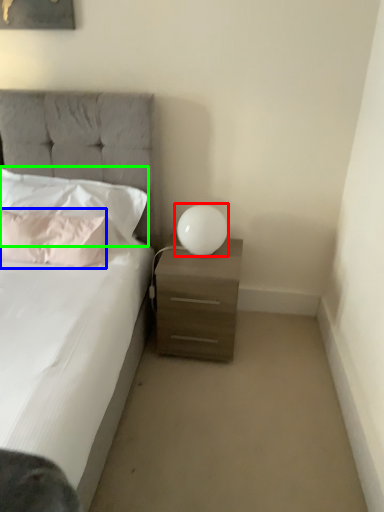
Question: Considering the real-world distances, which object is farthest from table lamp (highlighted by a red box)? pillow (highlighted by a blue box) or pillow (highlighted by a green box)?

Choices:
 (A) pillow
 (B) pillow

Answer: (A)